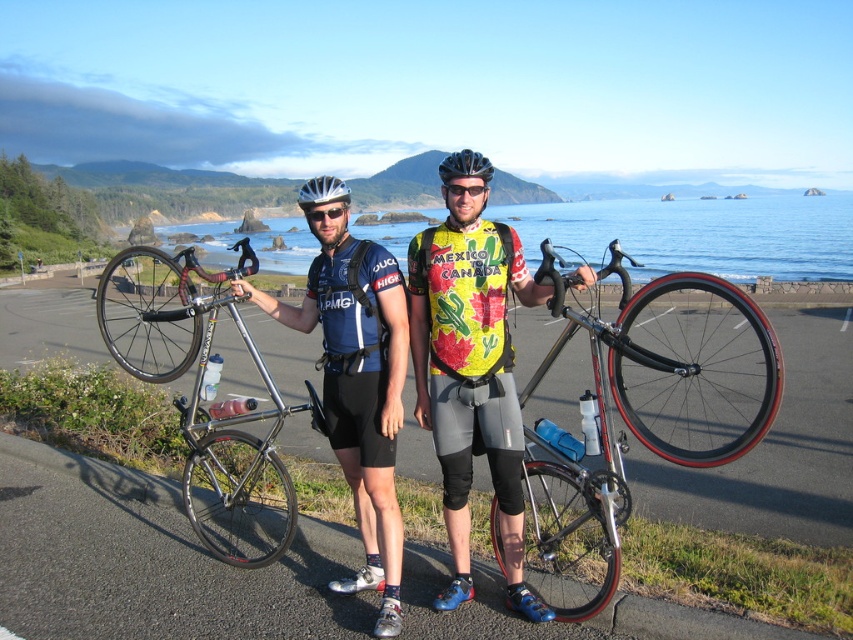
Question: Considering the relative positions of shiny silver bicycle at center and silver metallic bicycle at left in the image provided, where is shiny silver bicycle at center located with respect to silver metallic bicycle at left?

Choices:
 (A) right
 (B) left

Answer: (A)

Question: Among these points, which one is farthest from the camera?

Choices:
 (A) (483, 184)
 (B) (212, 364)
 (C) (389, 616)
 (D) (316, 182)

Answer: (B)

Question: Is silver metallic bicycle at left positioned in front of transparent plastic goggles at center?

Choices:
 (A) yes
 (B) no

Answer: (B)

Question: Which object is positioned farthest from the black matte bicycle helmet at center?

Choices:
 (A) matte black cycling jersey at center
 (B) silver metallic bicycle at left
 (C) shiny silver bicycle at center
 (D) silver metallic helmet at center

Answer: (B)

Question: Which object is the closest to the silver metallic helmet at center?

Choices:
 (A) matte black bicycle at center
 (B) silver metallic bicycle at left
 (C) matte black cycling jersey at center
 (D) transparent plastic goggles at center

Answer: (A)

Question: Does silver metallic bicycle at left have a smaller size compared to silver metallic helmet at center?

Choices:
 (A) yes
 (B) no

Answer: (A)